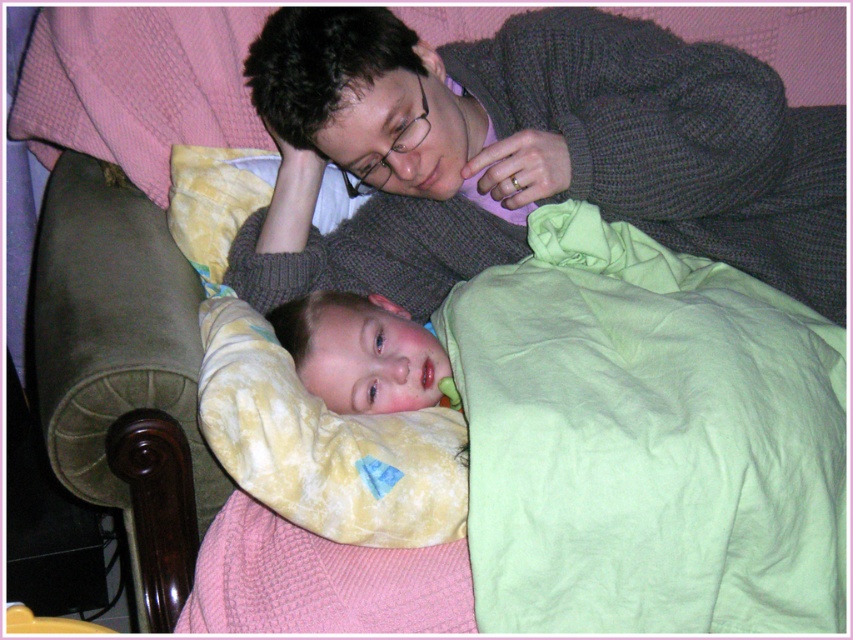
Who is more distant from viewer, (519, 168) or (347, 371)?

Point (519, 168)

Locate an element on the screen. knitted dark gray sweater at upper center is located at coordinates (531, 152).

Is green cotton blanket at lower right positioned behind smooth green pillow at lower center?

No, it is not.

Looking at this image, who is more forward, (747, 352) or (405, 362)?

Point (747, 352)

Is point (654, 275) in front of point (341, 333)?

No, it is behind (341, 333).

Locate an element on the screen. Image resolution: width=853 pixels, height=640 pixels. green cotton blanket at lower right is located at coordinates (646, 440).

Can you confirm if green cotton blanket at lower right is shorter than knitted dark gray sweater at upper center?

No.

Is the position of green cotton blanket at lower right less distant than that of knitted dark gray sweater at upper center?

Yes, green cotton blanket at lower right is in front of knitted dark gray sweater at upper center.

At what (x,y) coordinates should I click in order to perform the action: click on green cotton blanket at lower right. Please return your answer as a coordinate pair (x, y). The image size is (853, 640). Looking at the image, I should click on (646, 440).